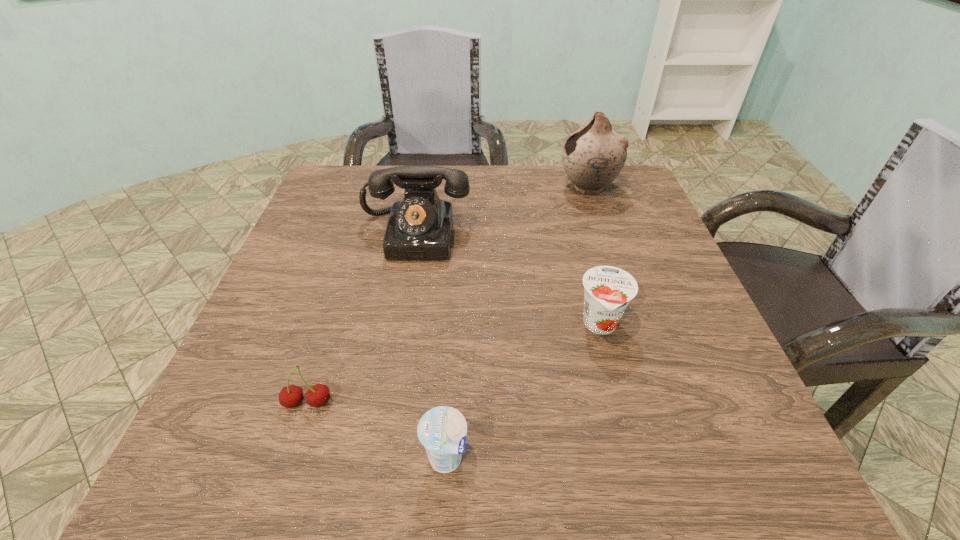
The width and height of the screenshot is (960, 540). Find the location of `free location at the near left corner`. free location at the near left corner is located at coordinates (265, 462).

The image size is (960, 540). Identify the location of vacant area between the cherry and the fourth nearest object. (362, 319).

You are a GUI agent. You are given a task and a screenshot of the screen. Output one action in this format:
    pyautogui.click(x=<x>, y=<y>)
    Task: Click on the free space between the tallest object and the telephone
    This screenshot has height=540, width=960.
    Given the screenshot: What is the action you would take?
    click(501, 211)

The height and width of the screenshot is (540, 960). Find the location of `empty location between the taller yogurt and the left yogurt`. empty location between the taller yogurt and the left yogurt is located at coordinates pos(523,392).

The image size is (960, 540). In order to click on free spot between the right yogurt and the cherry in this screenshot , I will do `click(454, 364)`.

At what (x,y) coordinates should I click in order to perform the action: click on free spot between the third farthest object and the tallest object. Please return your answer as a coordinate pair (x, y). This screenshot has width=960, height=540. Looking at the image, I should click on (594, 256).

Find the location of a particular element. vacant area between the farther yogurt and the fourth farthest object is located at coordinates (454, 364).

This screenshot has width=960, height=540. Find the location of `empty space between the pottery and the second farthest object`. empty space between the pottery and the second farthest object is located at coordinates [501, 211].

The width and height of the screenshot is (960, 540). Identify the location of unoccupied position between the cherry and the farther yogurt. (454, 364).

What are the coordinates of `empty space that is in between the tallest object and the third nearest object` in the screenshot? It's located at (594, 256).